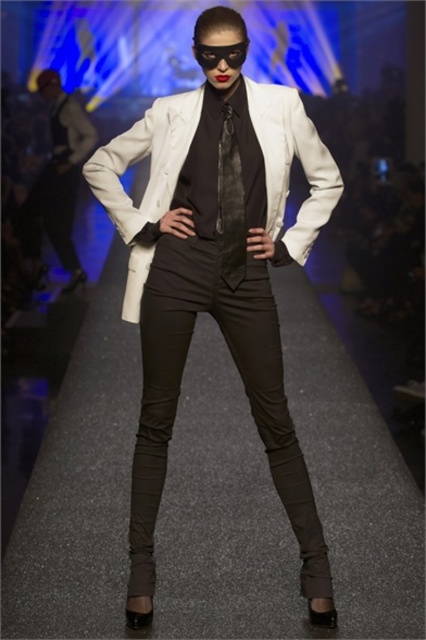
You are a photographer at a fashion show. You need to capture a closeup shot of the model wearing the matte black dress at left and the satin black tie at center. Which object should you focus on if you want to highlight the texture differences between the two?

You should focus on the matte black dress at left because its matte texture contrasts with the satin black tie at center, which has a smoother, reflective surface.